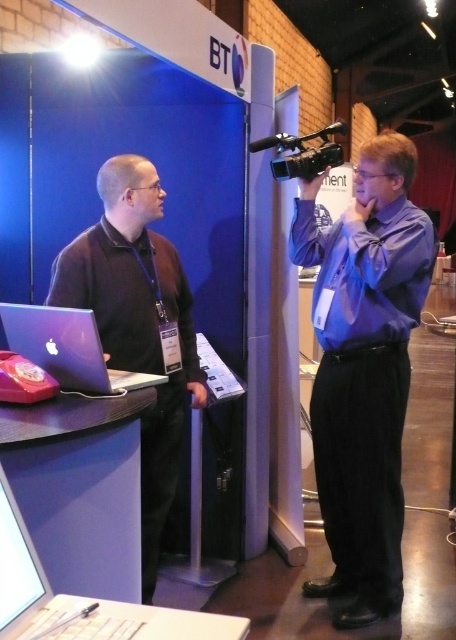
You are a technician who needs to place a new device that requires 40 centimeters of space between the matte black laptop at left and matte silver laptop at left. Can you fit it between them?

The distance between the matte black laptop at left and matte silver laptop at left is 37.65 centimeters, which is less than the required 40 centimeters. Therefore, the new device cannot be placed between them due to insufficient space.

You are a photographer at the event and need to capture a clear shot of both the matte black laptop at left and the matte silver laptop at left. Since you can only focus on one object at a time, which laptop should you focus on to ensure the other is still somewhat in focus?

You should focus on the matte black laptop at left because it is closer to you than the matte silver laptop at left. By focusing on the closer object, the depth of field may still keep the farther matte silver laptop at left somewhat in focus.